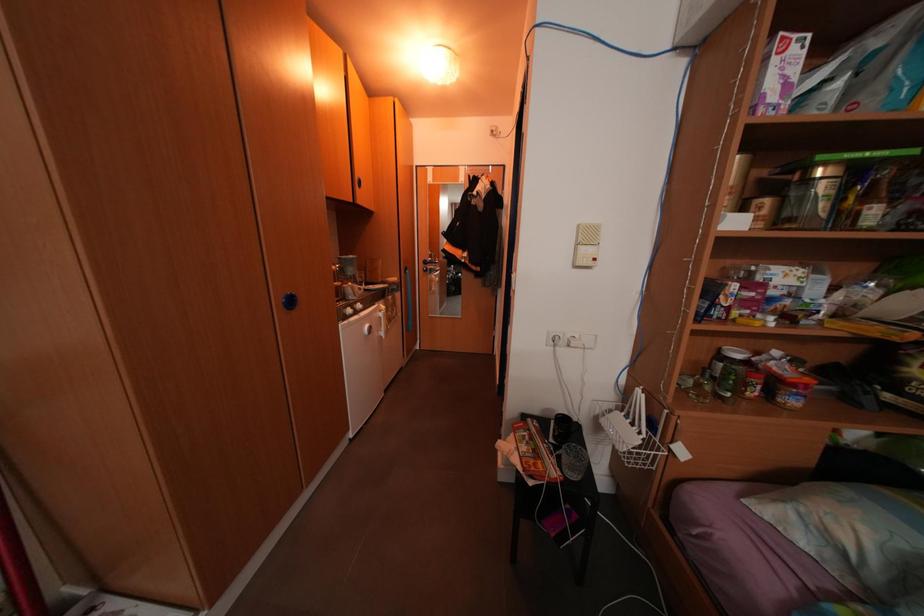
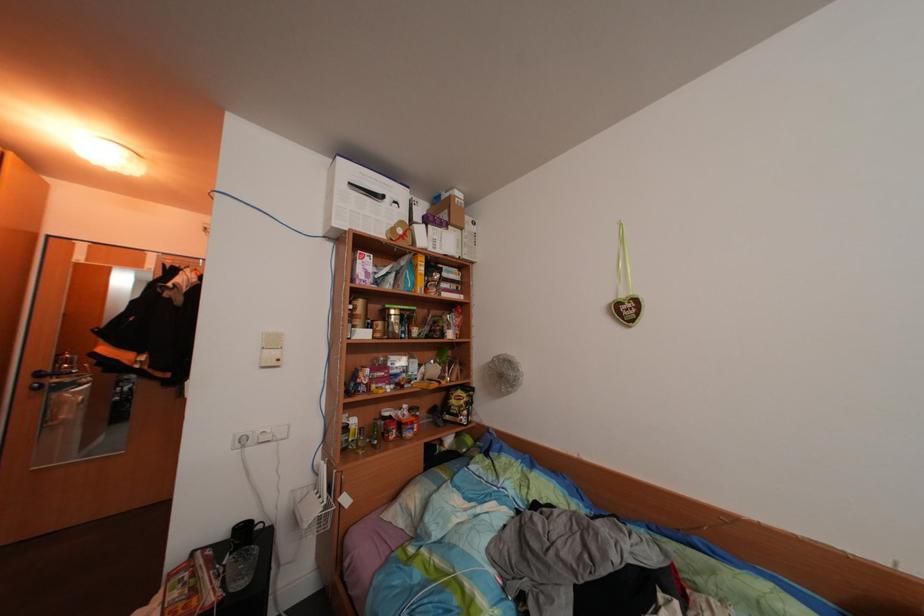
Based on the continuous images, in which direction is the camera rotating?

The rotation direction of the camera is right-up.